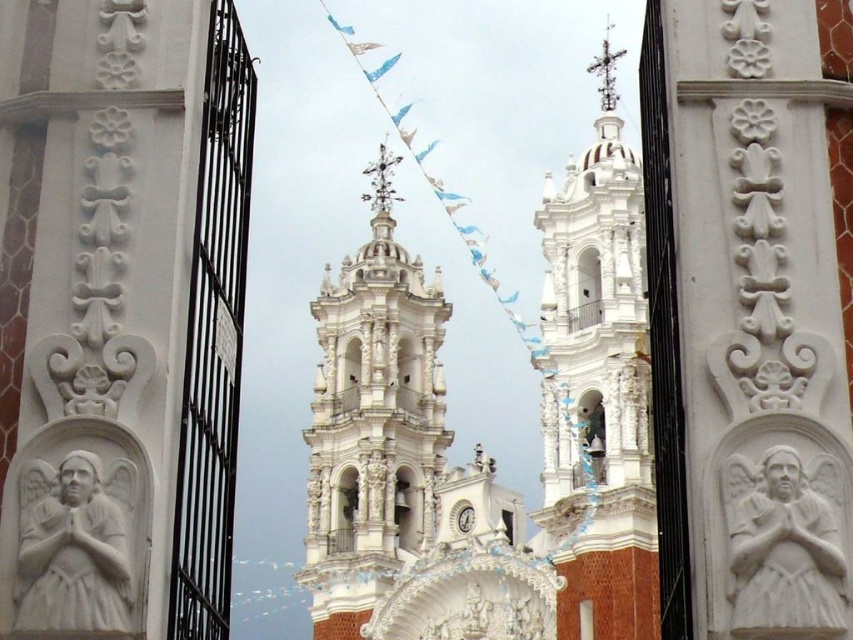
Is the position of white ornate tower at center less distant than that of white stone angel at left?

No.

Measure the distance from white ornate tower at center to white stone angel at left.

white ornate tower at center and white stone angel at left are 80.07 meters apart.

Is point (329, 312) more distant than point (96, 538)?

Yes.

At what (x,y) coordinates should I click in order to perform the action: click on white ornate tower at center. Please return your answer as a coordinate pair (x, y). This screenshot has height=640, width=853. Looking at the image, I should click on (x=372, y=420).

From the picture: Which is more to the left, white ornate tower at center or white stone angel at center?

white ornate tower at center

Is white ornate tower at center closer to camera compared to white stone angel at center?

No.

Does point (432, 413) come in front of point (837, 612)?

No, it is not.

The height and width of the screenshot is (640, 853). What are the coordinates of `white ornate tower at center` in the screenshot? It's located at [x=372, y=420].

Does white stone angel at center have a lesser height compared to white stone angel at left?

No.

Is white stone angel at center to the right of white stone angel at left from the viewer's perspective?

Yes, white stone angel at center is to the right of white stone angel at left.

I want to click on white stone angel at center, so click(x=782, y=550).

Locate an element on the screen. The image size is (853, 640). white stone angel at center is located at coordinates (782, 550).